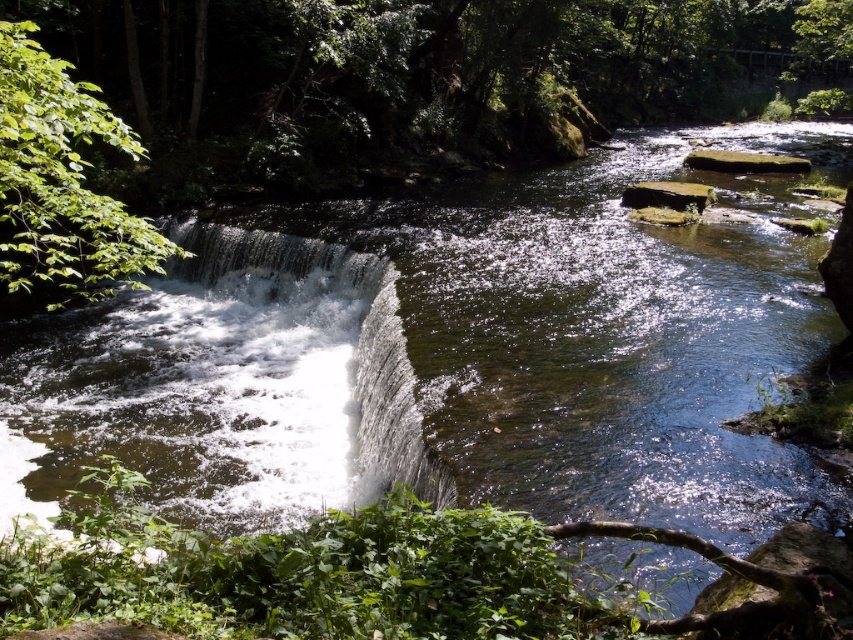
Question: Does white frothy water at center appear under green leafy tree at left?

Choices:
 (A) yes
 (B) no

Answer: (A)

Question: Which point appears closest to the camera in this image?

Choices:
 (A) [x=26, y=451]
 (B) [x=67, y=172]

Answer: (B)

Question: Can you confirm if white frothy water at center is positioned below green leafy tree at left?

Choices:
 (A) yes
 (B) no

Answer: (A)

Question: Does white frothy water at center have a smaller size compared to green leafy tree at left?

Choices:
 (A) yes
 (B) no

Answer: (A)

Question: Which of the following is the closest to the observer?

Choices:
 (A) (55, 234)
 (B) (260, 308)

Answer: (A)